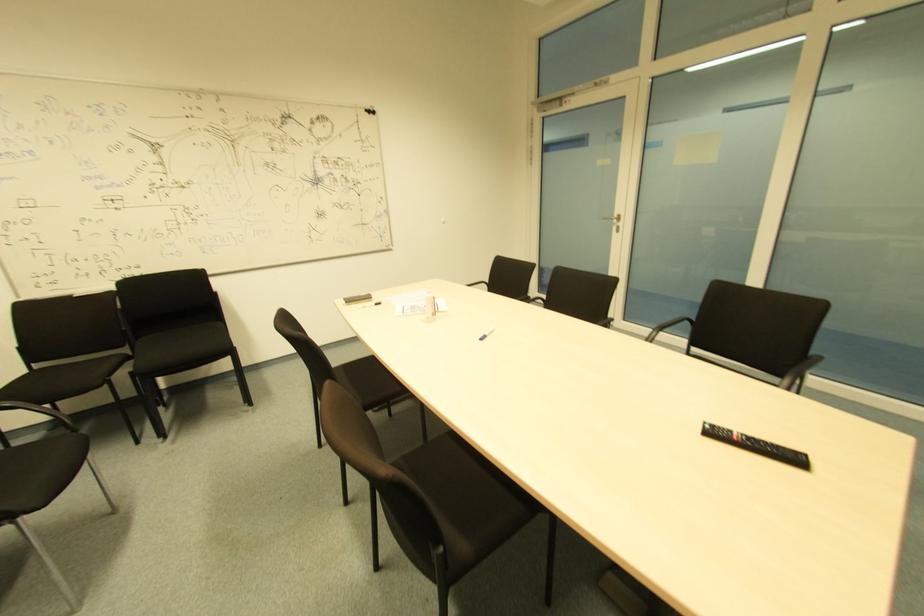
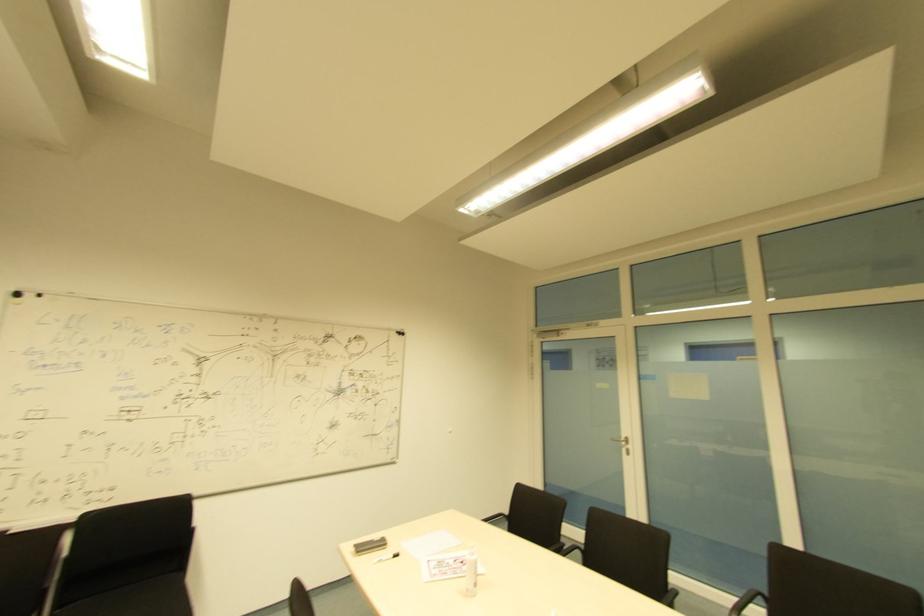
Where in the second image is the point corresponding to pixel 618 227 from the first image?

(628, 450)